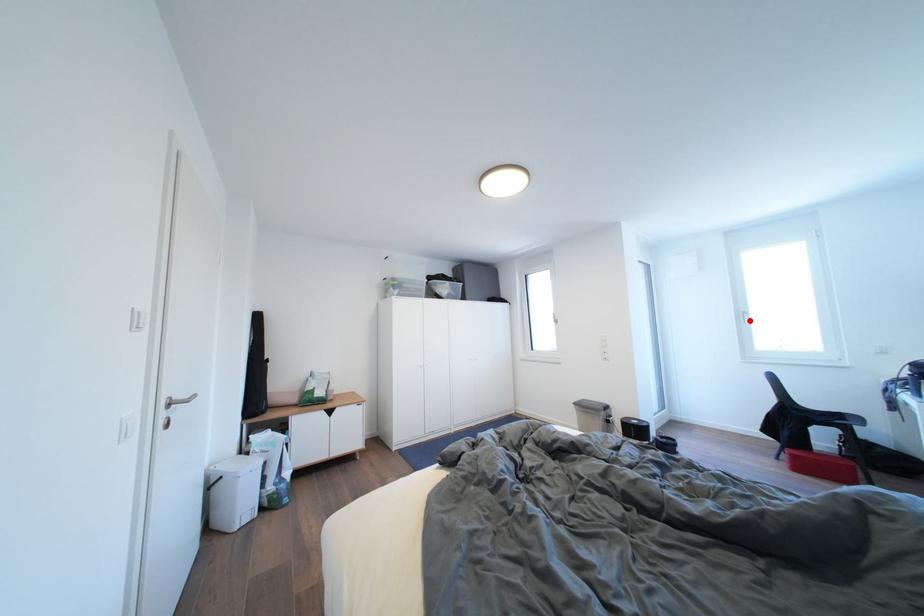
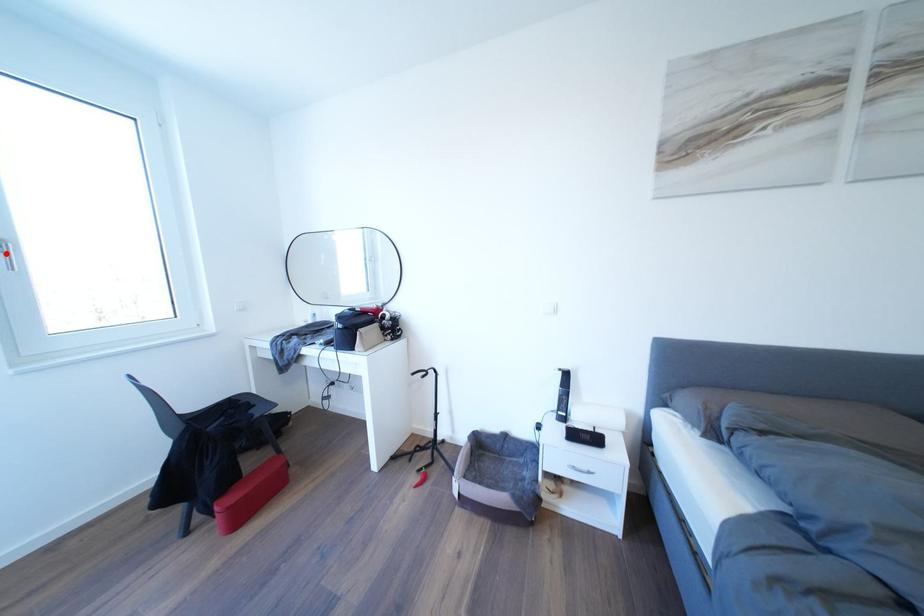
I am providing you with two images of the same scene from different viewpoints. A red point is marked on the first image and another point is marked on the second image. Is the marked point in image1 the same physical position as the marked point in image2?

Yes